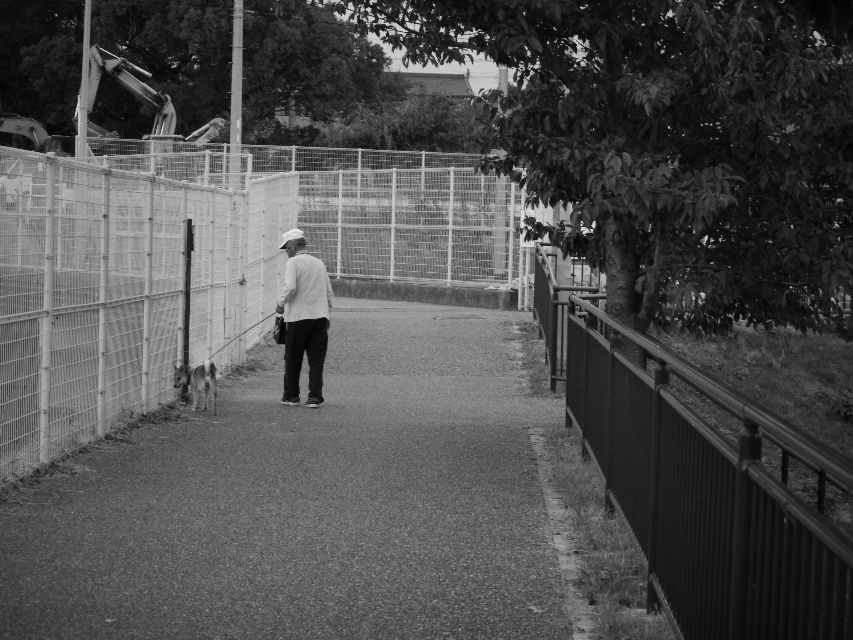
Does point (10, 621) come behind point (254, 253)?

No, it is in front of (254, 253).

Does smooth asphalt pavement at center lie in front of metallic wire mesh fence at left?

Yes, it is in front of metallic wire mesh fence at left.

The height and width of the screenshot is (640, 853). In order to click on smooth asphalt pavement at center in this screenshot , I will do `click(306, 502)`.

Identify the location of smooth asphalt pavement at center. The height and width of the screenshot is (640, 853). (306, 502).

Is smooth asphalt pavement at center smaller than smooth metal fence at right?

Correct, smooth asphalt pavement at center occupies less space than smooth metal fence at right.

Who is more forward, (x=531, y=522) or (x=802, y=483)?

Point (x=531, y=522) is in front.

You are a GUI agent. You are given a task and a screenshot of the screen. Output one action in this format:
    pyautogui.click(x=<x>, y=<y>)
    Task: Click on the smooth asphalt pavement at center
    The width and height of the screenshot is (853, 640).
    Given the screenshot: What is the action you would take?
    pyautogui.click(x=306, y=502)

Is metallic wire mesh fence at left above white matte shirt at center?

Indeed, metallic wire mesh fence at left is positioned over white matte shirt at center.

Which of these two, metallic wire mesh fence at left or white matte shirt at center, stands shorter?

white matte shirt at center is shorter.

Identify the location of metallic wire mesh fence at left. (120, 289).

I want to click on metallic wire mesh fence at left, so point(120,289).